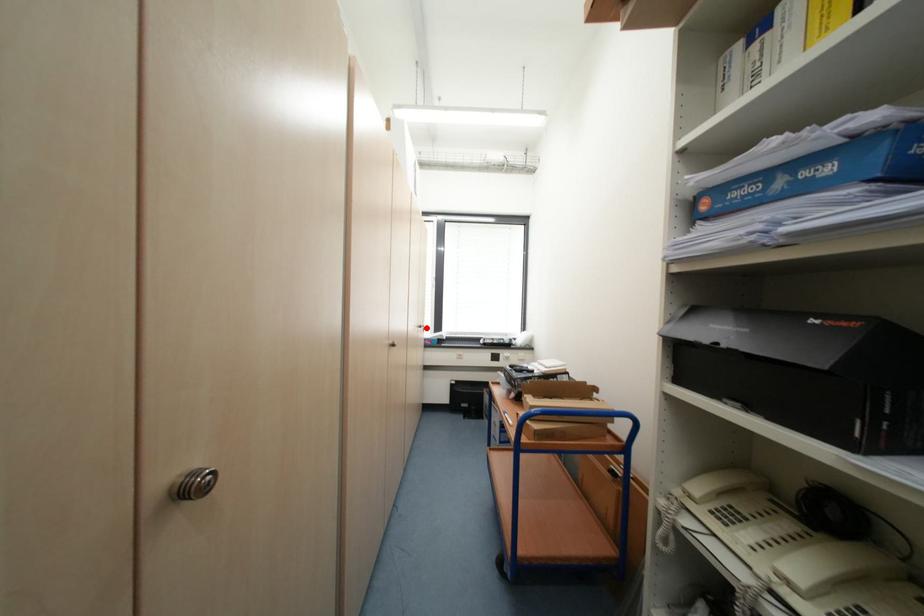
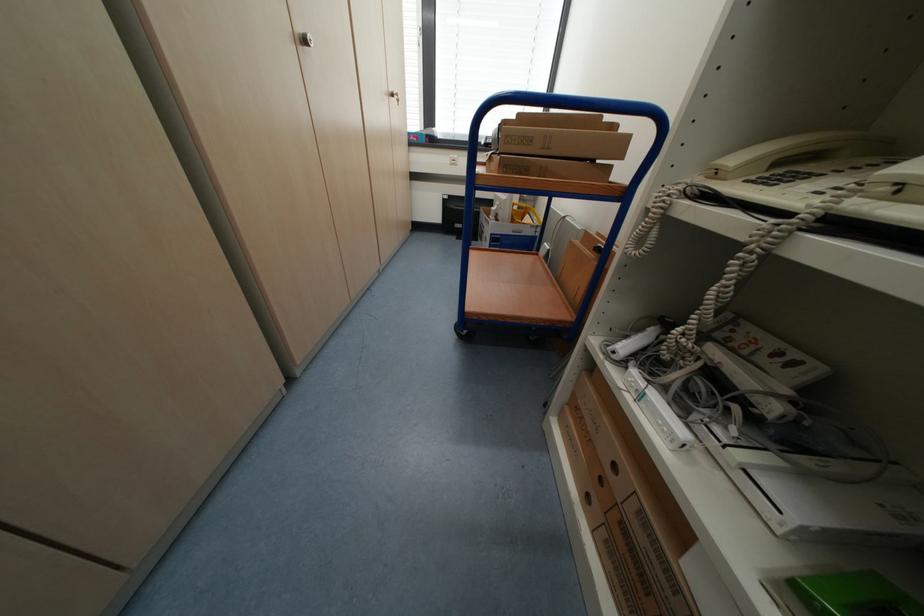
In the second image, find the point that corresponds to the highlighted location in the first image.

(398, 95)